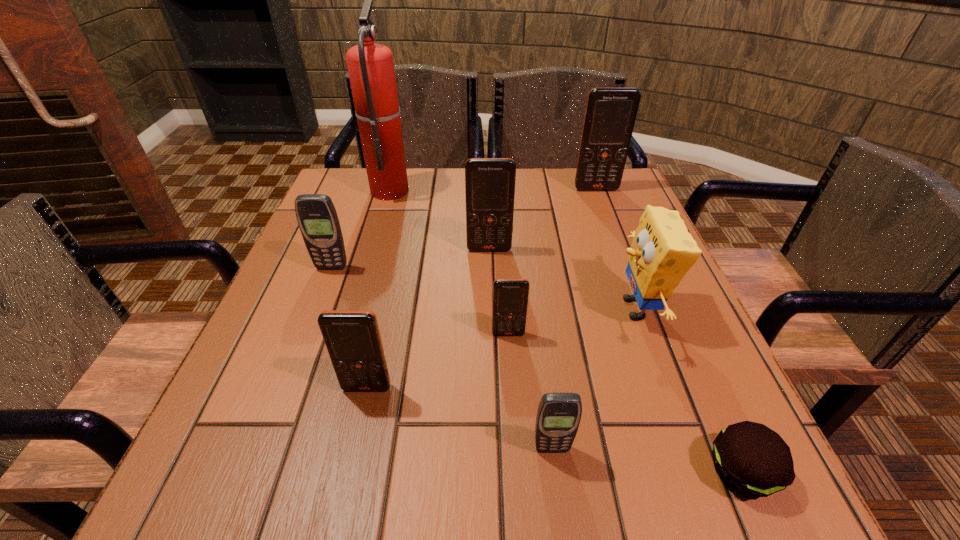
The height and width of the screenshot is (540, 960). Find the location of `vacant space that satisfies the following two spatial constraints: 1. with the nozzle and gauge on the red fire extinguisher; 2. on the screen of the leftmost cellular telephone`. vacant space that satisfies the following two spatial constraints: 1. with the nozzle and gauge on the red fire extinguisher; 2. on the screen of the leftmost cellular telephone is located at coordinates (368, 268).

I want to click on vacant space that satisfies the following two spatial constraints: 1. with the nozzle and gauge on the tallest object; 2. on the screen of the leftmost cellular telephone, so (x=368, y=268).